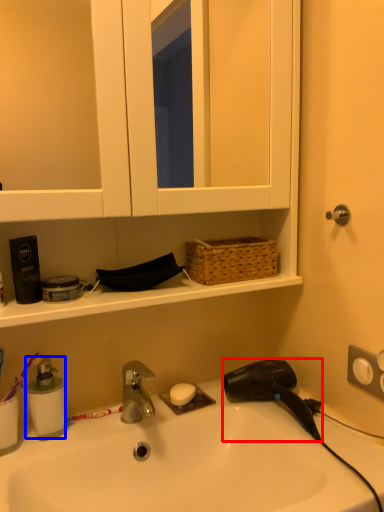
Question: Which point is closer to the camera, hair drier (highlighted by a red box) or soap dispenser (highlighted by a blue box)?

Choices:
 (A) hair drier
 (B) soap dispenser

Answer: (A)